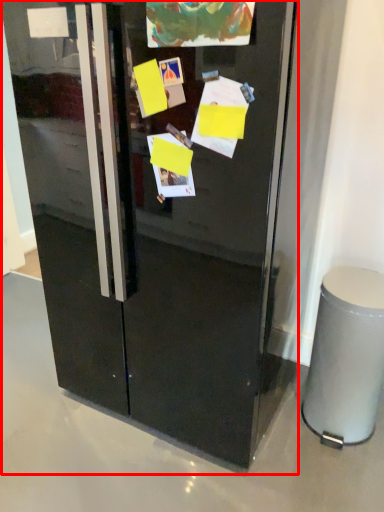
Question: Considering the relative positions of refrigerator (annotated by the red box) and trash bin/can in the image provided, where is refrigerator (annotated by the red box) located with respect to the staircase?

Choices:
 (A) left
 (B) right

Answer: (A)